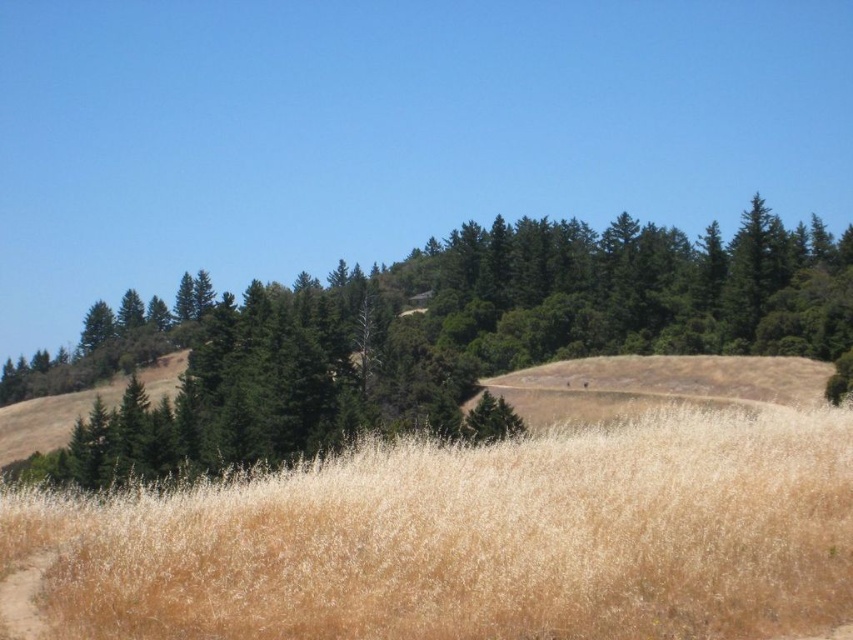
You are a hiker who wants to set up a tent in the area shown. Considering the dry grass at center and the green matte tree at center, which location would be safer for setting up your tent to avoid potential wildfires?

The green matte tree at center is safer for setting up the tent because it is thicker than the dry grass at center, providing better protection from potential wildfires.